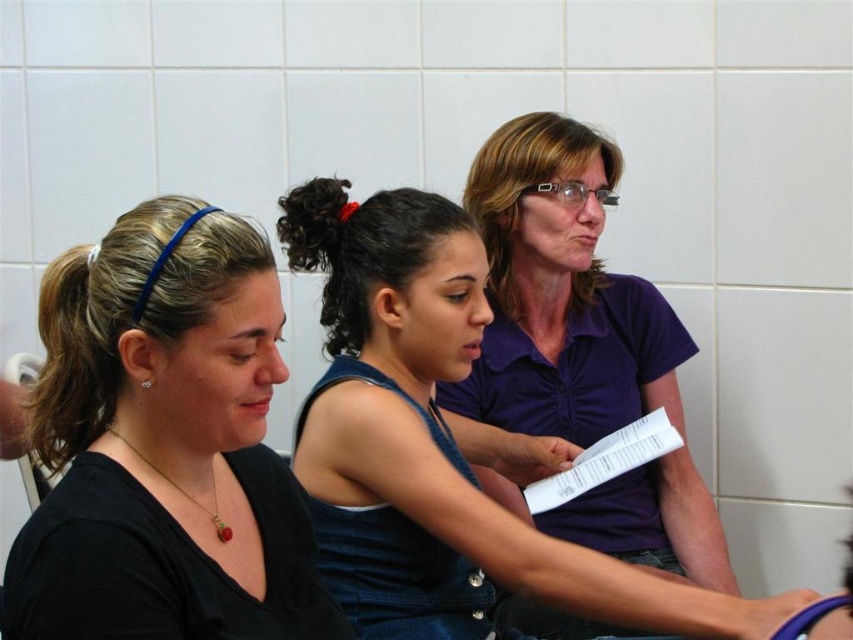
In the scene shown: Is curly hair at center further to camera compared to white paper at center?

That is False.

Is point (306, 244) positioned after point (656, 448)?

No, (306, 244) is in front of (656, 448).

Which is behind, point (358, 317) or point (569, 490)?

The point (569, 490) is more distant.

Image resolution: width=853 pixels, height=640 pixels. Identify the location of curly hair at center. (331, 253).

Does black matte shirt at center have a greater width compared to brown hair at left?

Correct, the width of black matte shirt at center exceeds that of brown hair at left.

Is point (256, 461) positioned behind point (96, 253)?

Yes, point (256, 461) is behind point (96, 253).

Which is behind, point (283, 364) or point (80, 352)?

The point (283, 364) is more distant.

Identify the location of black matte shirt at center. The image size is (853, 640). (164, 444).

Can you confirm if brown hair at left is positioned above curly hair at center?

No.

Does brown hair at left have a lesser width compared to curly hair at center?

In fact, brown hair at left might be wider than curly hair at center.

You are a GUI agent. You are given a task and a screenshot of the screen. Output one action in this format:
    pyautogui.click(x=<x>, y=<y>)
    Task: Click on the brown hair at left
    The height and width of the screenshot is (640, 853).
    Given the screenshot: What is the action you would take?
    pyautogui.click(x=73, y=358)